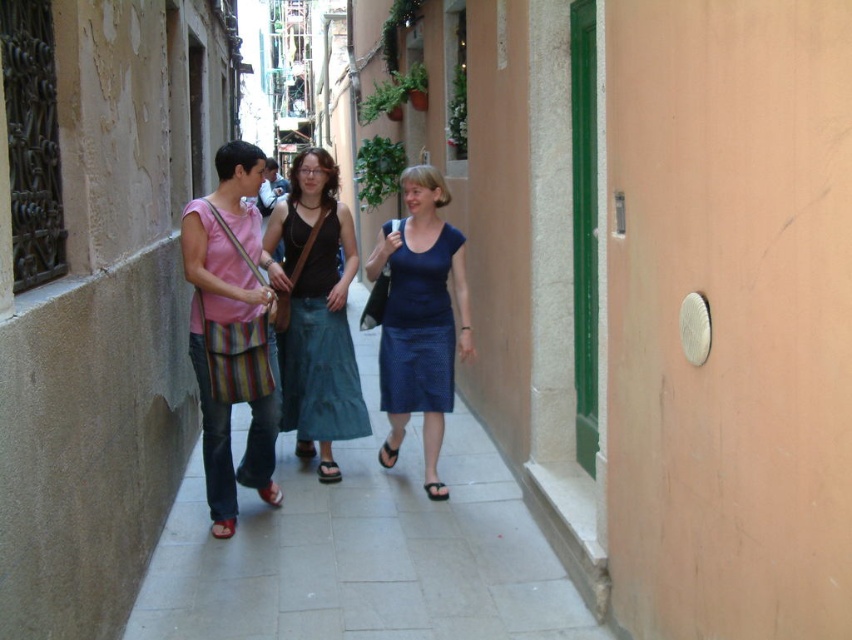
Is gray concrete pavement at center closer to camera compared to matte black tank top at center?

No, gray concrete pavement at center is further to the viewer.

Does gray concrete pavement at center have a lesser height compared to matte black tank top at center?

Yes, gray concrete pavement at center is shorter than matte black tank top at center.

Find the location of a particular element. This screenshot has width=852, height=640. gray concrete pavement at center is located at coordinates (366, 548).

Where is `gray concrete pavement at center`? This screenshot has width=852, height=640. gray concrete pavement at center is located at coordinates (366, 548).

Does brown leather sandal at center appear on the left side of red leather sandal at lower left?

In fact, brown leather sandal at center is to the right of red leather sandal at lower left.

Which is in front, point (323, 461) or point (217, 522)?

Point (217, 522) is in front.

Is point (332, 474) in front of point (229, 525)?

No, (332, 474) is further to viewer.

Locate an element on the screen. This screenshot has width=852, height=640. brown leather sandal at center is located at coordinates (327, 472).

Is gray concrete pavement at center wider than red leather sandal at lower left?

Correct, the width of gray concrete pavement at center exceeds that of red leather sandal at lower left.

Does gray concrete pavement at center appear on the left side of red leather sandal at lower left?

Incorrect, gray concrete pavement at center is not on the left side of red leather sandal at lower left.

Between point (349, 483) and point (227, 524), which one is positioned behind?

The point (349, 483) is more distant.

Where is `gray concrete pavement at center`? gray concrete pavement at center is located at coordinates (366, 548).